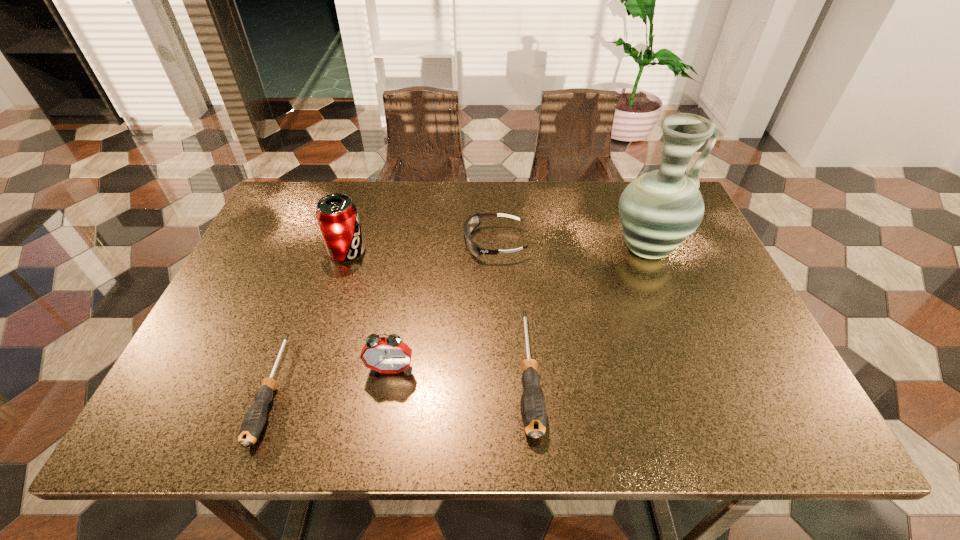
Locate an element on the screen. The height and width of the screenshot is (540, 960). object situated at the far right corner is located at coordinates click(x=658, y=210).

At what (x,y) coordinates should I click in order to perform the action: click on free space at the far edge of the desktop. Please return your answer as a coordinate pair (x, y). This screenshot has width=960, height=540. Looking at the image, I should click on (563, 217).

In the image, there is a desktop. Identify the location of free space at the left edge. (285, 301).

In the image, there is a desktop. Where is `vacant area at the right edge`? vacant area at the right edge is located at coordinates (680, 268).

Where is `empty space between the shorter screwdriver and the right screwdriver`? empty space between the shorter screwdriver and the right screwdriver is located at coordinates (400, 381).

This screenshot has width=960, height=540. Identify the location of free area in between the right screwdriver and the alarm clock. (460, 371).

I want to click on blank region between the second tallest object and the right screwdriver, so click(438, 312).

The width and height of the screenshot is (960, 540). I want to click on vacant region between the soda can and the shorter screwdriver, so [310, 320].

Find the location of a particular element. The height and width of the screenshot is (540, 960). empty location between the shorter screwdriver and the second tallest object is located at coordinates (310, 320).

At what (x,y) coordinates should I click in order to perform the action: click on vacant space in between the alarm clock and the tallest object. Please return your answer as a coordinate pair (x, y). This screenshot has width=960, height=540. Looking at the image, I should click on (518, 309).